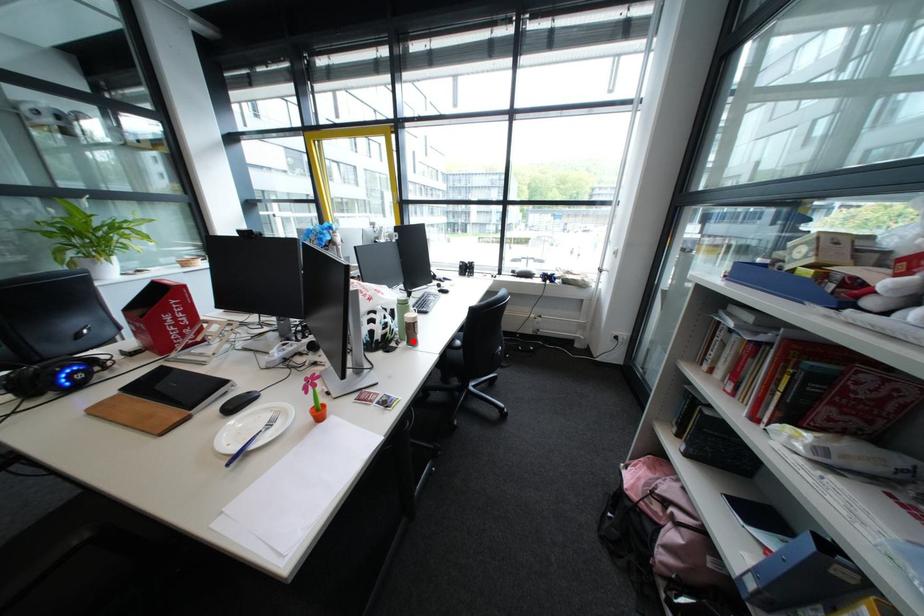
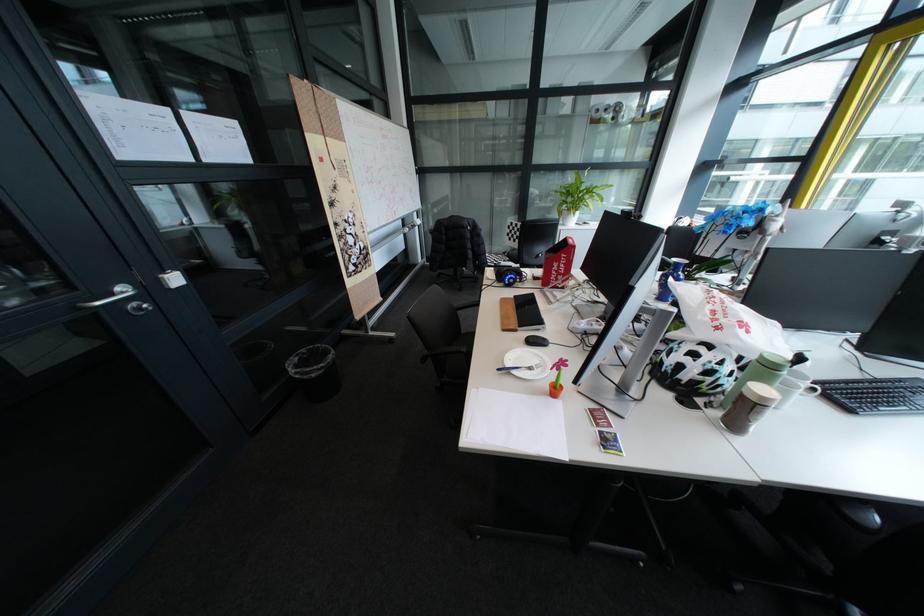
The point at the highlighted location is marked in the first image. Where is the corresponding point in the second image?

(728, 406)